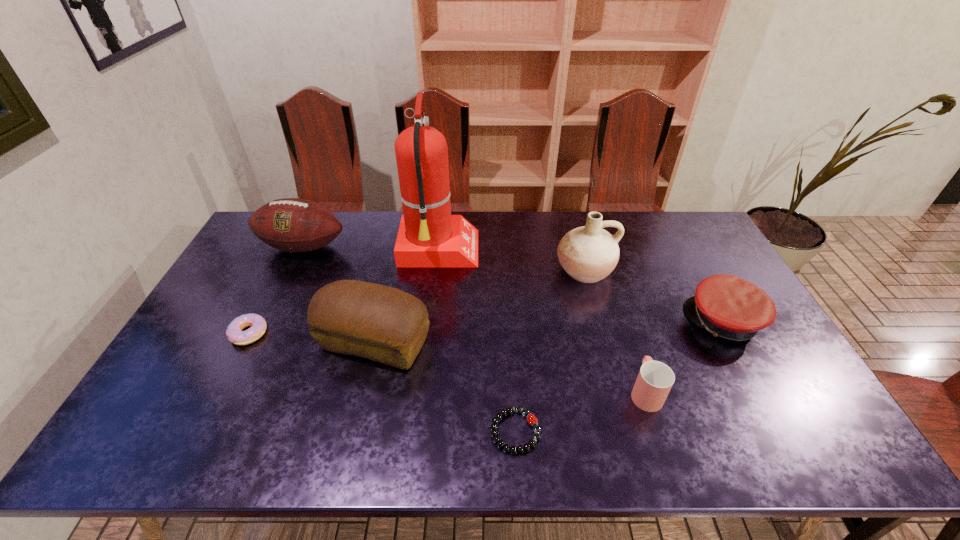
You are a GUI agent. You are given a task and a screenshot of the screen. Output one action in this format:
    pyautogui.click(x=<x>, y=<y>)
    Task: Click on the vacant space at the left edge of the desktop
    
    Given the screenshot: What is the action you would take?
    pyautogui.click(x=219, y=324)

The width and height of the screenshot is (960, 540). Identify the location of vacant space at the right edge of the desktop. (762, 379).

The width and height of the screenshot is (960, 540). In the image, there is a desktop. In order to click on vacant space at the far right corner in this screenshot , I will do (x=700, y=229).

In order to click on empty space between the shortest object and the fire extinguisher in this screenshot , I will do `click(477, 341)`.

This screenshot has height=540, width=960. I want to click on free spot between the bread and the bracelet, so click(444, 387).

This screenshot has width=960, height=540. In order to click on unoccupied area between the fire extinguisher and the pottery in this screenshot , I will do `click(512, 260)`.

At what (x,y) coordinates should I click in order to perform the action: click on free space that is in between the cup and the cap. Please return your answer as a coordinate pair (x, y). Image resolution: width=960 pixels, height=540 pixels. Looking at the image, I should click on (684, 357).

The height and width of the screenshot is (540, 960). Identify the location of empty space between the pottery and the tallest object. (512, 260).

I want to click on vacant point located between the football (American) and the cup, so click(474, 319).

I want to click on blank region between the pottery and the cup, so click(x=614, y=331).